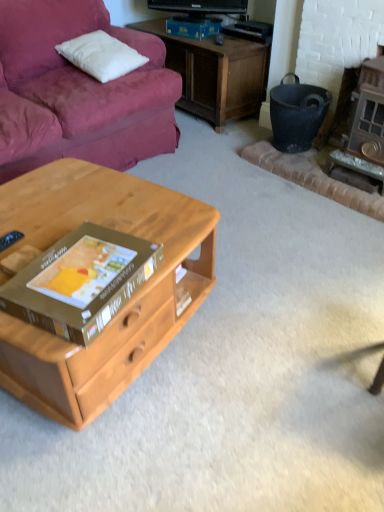
Question: Choose the correct answer: Is wooden fireplace at right inside black matte trash bin/can at right or outside it?

Choices:
 (A) outside
 (B) inside

Answer: (A)

Question: From the image's perspective, relative to black matte trash bin/can at right, is wooden fireplace at right above or below?

Choices:
 (A) above
 (B) below

Answer: (B)

Question: Which of these objects is positioned farthest from the light wood desk at center?

Choices:
 (A) brown cardboard box at center
 (B) wooden fireplace at right
 (C) white soft pillow at upper left
 (D) black matte trash bin/can at right

Answer: (D)

Question: Estimate the real-world distances between objects in this image. Which object is closer to the white soft pillow at upper left?

Choices:
 (A) black matte trash bin/can at right
 (B) light wood desk at center
 (C) brown cardboard box at center
 (D) wooden fireplace at right

Answer: (A)